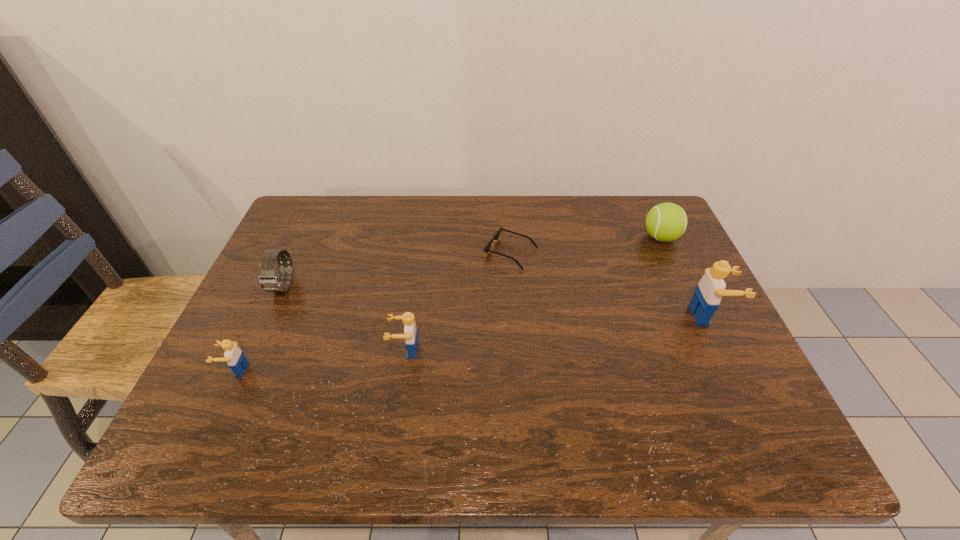
Locate an element on the screen. This screenshot has width=960, height=540. the shortest Lego is located at coordinates (234, 356).

This screenshot has height=540, width=960. I want to click on the second Lego from right to left, so click(410, 334).

Locate an element on the screen. the fourth object from right to left is located at coordinates (410, 334).

Identify the location of the tallest Lego. The width and height of the screenshot is (960, 540). (709, 291).

You are a GUI agent. You are given a task and a screenshot of the screen. Output one action in this format:
    pyautogui.click(x=<x>, y=<y>)
    Task: Click on the rightmost Lego
    Image resolution: width=960 pixels, height=540 pixels.
    Given the screenshot: What is the action you would take?
    pyautogui.click(x=709, y=291)

This screenshot has width=960, height=540. What are the coordinates of `the shortest object` in the screenshot? It's located at (487, 249).

Find the location of a particular element. The image size is (960, 540). the third object from right to left is located at coordinates (487, 249).

This screenshot has width=960, height=540. Find the location of `tennis ball`. tennis ball is located at coordinates (665, 222).

Where is `watch`? The width and height of the screenshot is (960, 540). watch is located at coordinates (268, 280).

The width and height of the screenshot is (960, 540). I want to click on free space located on the face of the second Lego from right to left, so click(x=347, y=350).